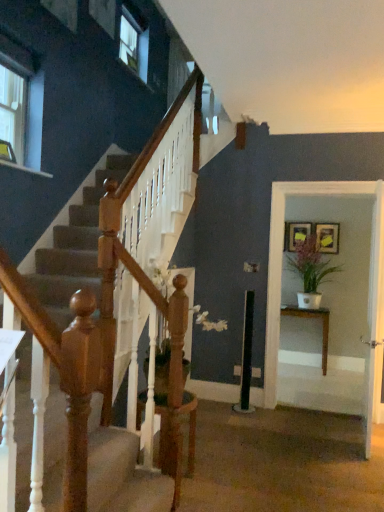
Looking at this image, what is the approximate height of matte gold picture frame at upper right, which is the first picture frame in left-to-right order?

matte gold picture frame at upper right, which is the first picture frame in left-to-right order, is 15.63 inches in height.

Where is `matte gold picture frame at upper right, the 2th picture frame in the right-to-left sequence`? matte gold picture frame at upper right, the 2th picture frame in the right-to-left sequence is located at coordinates (296, 234).

Where is `wooden table at right`? The image size is (384, 512). wooden table at right is located at coordinates (312, 318).

What do you see at coordinates (12, 113) in the screenshot? This screenshot has height=512, width=384. I see `clear glass window at upper left` at bounding box center [12, 113].

Image resolution: width=384 pixels, height=512 pixels. Identify the location of white glossy table at right. (282, 261).

What is the approximate width of wooden picture frame at upper right, which is the second picture frame from left to right?

The width of wooden picture frame at upper right, which is the second picture frame from left to right, is 2.62 inches.

What do you see at coordinates (310, 269) in the screenshot?
I see `green matte plant at right` at bounding box center [310, 269].

At what (x,y) coordinates should I click in order to perform the action: click on white glossy door at center. Please return your answer as a coordinate pair (x, y). The height and width of the screenshot is (512, 384). Looking at the image, I should click on (374, 313).

Find the location of a particular element. This screenshot has width=384, height=512. glass door below the green matte plant at right (from a real-world perspective) is located at coordinates (282, 261).

Which object is closer to the camera taking this photo, green matte plant at right or white glossy table at right?

white glossy table at right is in front.

Can you confirm if green matte plant at right is bigger than white glossy table at right?

Actually, green matte plant at right might be smaller than white glossy table at right.

From a real-world perspective, between green matte plant at right and white glossy table at right, who is vertically higher?

green matte plant at right, from a real-world perspective.

From the image's perspective, is white glossy door at center above or below clear glass window at upper left?

white glossy door at center is situated lower than clear glass window at upper left in the image.

Measure the distance between white glossy door at center and clear glass window at upper left.

white glossy door at center is 3.13 meters away from clear glass window at upper left.

This screenshot has width=384, height=512. Find the location of `window located on the left of white glossy door at center`. window located on the left of white glossy door at center is located at coordinates (12, 113).

Does white glossy door at center lie in front of clear glass window at upper left?

Yes, it is.

Based on their sizes in the image, would you say wooden table at right is bigger or smaller than matte gold picture frame at upper right, the 2th picture frame in the right-to-left sequence?

wooden table at right is bigger than matte gold picture frame at upper right, the 2th picture frame in the right-to-left sequence.

What are the coordinates of `table in front of the matte gold picture frame at upper right, the 2th picture frame in the right-to-left sequence` in the screenshot? It's located at (312, 318).

Could you measure the distance between wooden table at right and matte gold picture frame at upper right, the 2th picture frame in the right-to-left sequence?

wooden table at right is 3.43 feet from matte gold picture frame at upper right, the 2th picture frame in the right-to-left sequence.

From a real-world perspective, is wooden table at right positioned above or below matte gold picture frame at upper right, which is the first picture frame in left-to-right order?

Clearly, from a real-world perspective, wooden table at right is below matte gold picture frame at upper right, which is the first picture frame in left-to-right order.

From the picture: Is green matte plant at right to the right of matte gold picture frame at upper right, which is the first picture frame in left-to-right order, from the viewer's perspective?

Correct, you'll find green matte plant at right to the right of matte gold picture frame at upper right, which is the first picture frame in left-to-right order.

How many degrees apart are the facing directions of green matte plant at right and matte gold picture frame at upper right, the 2th picture frame in the right-to-left sequence?

They differ by 1.01 degrees in their facing directions.

Which of these two, green matte plant at right or matte gold picture frame at upper right, which is the first picture frame in left-to-right order, is bigger?

Bigger between the two is green matte plant at right.

Considering the relative sizes of white glossy table at right and white glossy door at center in the image provided, is white glossy table at right wider than white glossy door at center?

Indeed, white glossy table at right has a greater width compared to white glossy door at center.

From a real-world perspective, which object stands above the other?

white glossy table at right, from a real-world perspective.

From the picture: Is white glossy table at right at the left side of white glossy door at center?

Indeed, white glossy table at right is positioned on the left side of white glossy door at center.

Considering the relative sizes of white glossy table at right and white glossy door at center in the image provided, is white glossy table at right taller than white glossy door at center?

Correct, white glossy table at right is much taller as white glossy door at center.

Does matte gold picture frame at upper right, which is the first picture frame in left-to-right order, lie behind white glossy table at right?

Yes, matte gold picture frame at upper right, which is the first picture frame in left-to-right order, is behind white glossy table at right.

Does point (288, 250) appear closer or farther from the camera than point (336, 193)?

Point (288, 250) is farther from the camera than point (336, 193).

Can you confirm if matte gold picture frame at upper right, which is the first picture frame in left-to-right order, is wider than white glossy table at right?

Incorrect, the width of matte gold picture frame at upper right, which is the first picture frame in left-to-right order, does not surpass that of white glossy table at right.

From the image's perspective, between matte gold picture frame at upper right, the 2th picture frame in the right-to-left sequence, and white glossy table at right, which one is located above?

matte gold picture frame at upper right, the 2th picture frame in the right-to-left sequence, appears higher in the image.

Looking at this image, can you confirm if clear glass window at upper left is bigger than matte gold picture frame at upper right, which is the first picture frame in left-to-right order?

Indeed, clear glass window at upper left has a larger size compared to matte gold picture frame at upper right, which is the first picture frame in left-to-right order.

Is clear glass window at upper left thinner than matte gold picture frame at upper right, the 2th picture frame in the right-to-left sequence?

Correct, the width of clear glass window at upper left is less than that of matte gold picture frame at upper right, the 2th picture frame in the right-to-left sequence.

Is clear glass window at upper left to the right of matte gold picture frame at upper right, the 2th picture frame in the right-to-left sequence, from the viewer's perspective?

In fact, clear glass window at upper left is to the left of matte gold picture frame at upper right, the 2th picture frame in the right-to-left sequence.

Which is in front, point (15, 143) or point (289, 226)?

The point (15, 143) is closer.

Find the location of a particular element. Image resolution: width=384 pixels, height=512 pixels. houseplant on the right of white glossy table at right is located at coordinates (310, 269).

At what (x,y) coordinates should I click in order to perform the action: click on window positioned vertically above the white glossy door at center (from a real-world perspective). Please return your answer as a coordinate pair (x, y). Image resolution: width=384 pixels, height=512 pixels. Looking at the image, I should click on (12, 113).

Estimate the real-world distances between objects in this image. Which object is closer to wooden picture frame at upper right, which is the second picture frame from left to right, matte gold picture frame at upper right, which is the first picture frame in left-to-right order, or white glossy door at center?

Based on the image, matte gold picture frame at upper right, which is the first picture frame in left-to-right order, appears to be nearer to wooden picture frame at upper right, which is the second picture frame from left to right.

In the scene shown: Estimate the real-world distances between objects in this image. Which object is closer to white glossy table at right, wooden table at right or matte gold picture frame at upper right, the 2th picture frame in the right-to-left sequence?

wooden table at right lies closer to white glossy table at right than the other object.

Which object lies nearer to the anchor point matte gold picture frame at upper right, which is the first picture frame in left-to-right order, white glossy table at right or green matte plant at right?

Among the two, green matte plant at right is located nearer to matte gold picture frame at upper right, which is the first picture frame in left-to-right order.

Based on their spatial positions, is green matte plant at right or wooden picture frame at upper right, which is the second picture frame from left to right, further from clear glass window at upper left?

Based on the image, wooden picture frame at upper right, which is the second picture frame from left to right, appears to be further to clear glass window at upper left.

Based on the photo, based on their spatial positions, is wooden table at right or clear glass window at upper left closer to green matte plant at right?

wooden table at right lies closer to green matte plant at right than the other object.

Considering their positions, is white glossy door at center positioned further to wooden picture frame at upper right, which is the second picture frame from left to right, than white glossy table at right?

Among the two, white glossy door at center is located further to wooden picture frame at upper right, which is the second picture frame from left to right.

From the picture: Based on their spatial positions, is white glossy table at right or matte gold picture frame at upper right, the 2th picture frame in the right-to-left sequence, closer to green matte plant at right?

Among the two, matte gold picture frame at upper right, the 2th picture frame in the right-to-left sequence, is located nearer to green matte plant at right.

Which object lies nearer to the anchor point matte gold picture frame at upper right, the 2th picture frame in the right-to-left sequence, green matte plant at right or wooden table at right?

green matte plant at right is positioned closer to the anchor matte gold picture frame at upper right, the 2th picture frame in the right-to-left sequence.

Find the location of a particular element. This screenshot has width=384, height=512. table located between clear glass window at upper left and matte gold picture frame at upper right, which is the first picture frame in left-to-right order, in the left-right direction is located at coordinates (312, 318).

Find the location of a particular element. The width and height of the screenshot is (384, 512). houseplant between white glossy door at center and wooden picture frame at upper right, which is the second picture frame from left to right, from front to back is located at coordinates (310, 269).

The width and height of the screenshot is (384, 512). What are the coordinates of `houseplant between white glossy door at center and wooden table at right from front to back` in the screenshot? It's located at (310, 269).

Find the location of a particular element. houseplant between wooden picture frame at upper right, which is the second picture frame from left to right, and wooden table at right in the up-down direction is located at coordinates (310, 269).